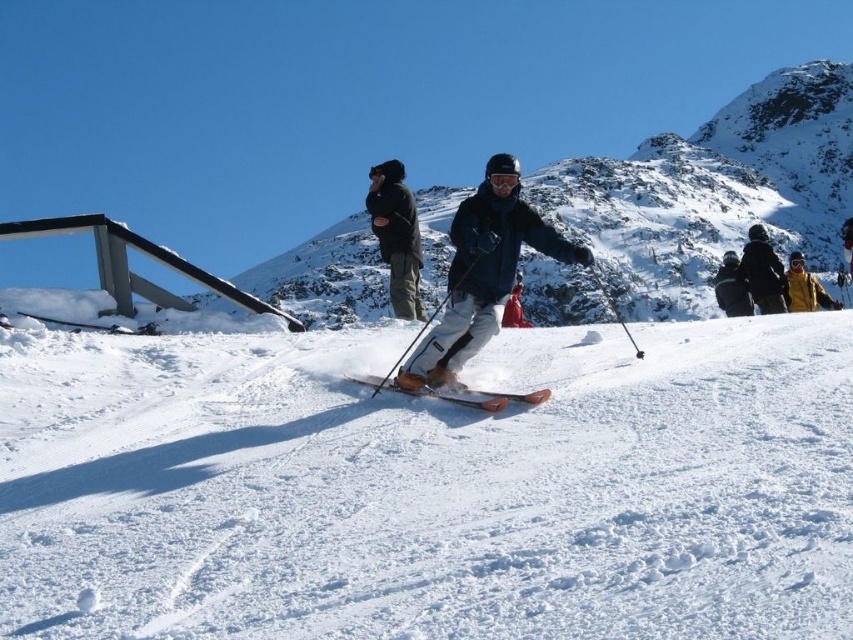
Question: Does matte black snowboard at center have a larger size compared to matte black jacket at right?

Choices:
 (A) no
 (B) yes

Answer: (B)

Question: Which object appears farthest from the camera in this image?

Choices:
 (A) matte black snowboard at center
 (B) dark blue jacket at upper right
 (C) yellow matte jacket at upper right

Answer: (C)

Question: Among these points, which one is farthest from the camera?

Choices:
 (A) (485, 406)
 (B) (788, 280)
 (C) (780, 268)
 (D) (368, 189)

Answer: (B)

Question: Is white snow at center wider than yellow matte jacket at upper right?

Choices:
 (A) no
 (B) yes

Answer: (B)

Question: Based on their relative distances, which object is farther from the dark blue jacket at upper right?

Choices:
 (A) matte black snowboard at center
 (B) black fabric jacket at upper center

Answer: (B)

Question: Observing the image, what is the correct spatial positioning of white snow at center in reference to dark blue jacket at upper right?

Choices:
 (A) left
 (B) right

Answer: (A)